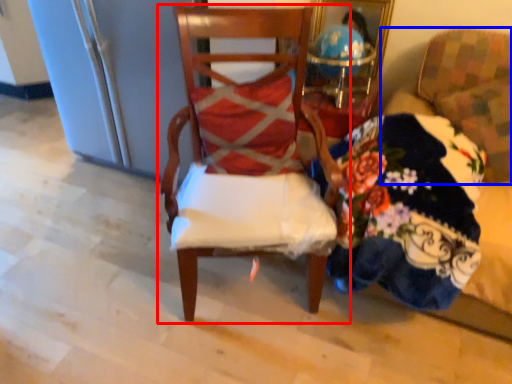
Question: Which point is further to the camera, chair (highlighted by a red box) or chair (highlighted by a blue box)?

Choices:
 (A) chair
 (B) chair

Answer: (B)